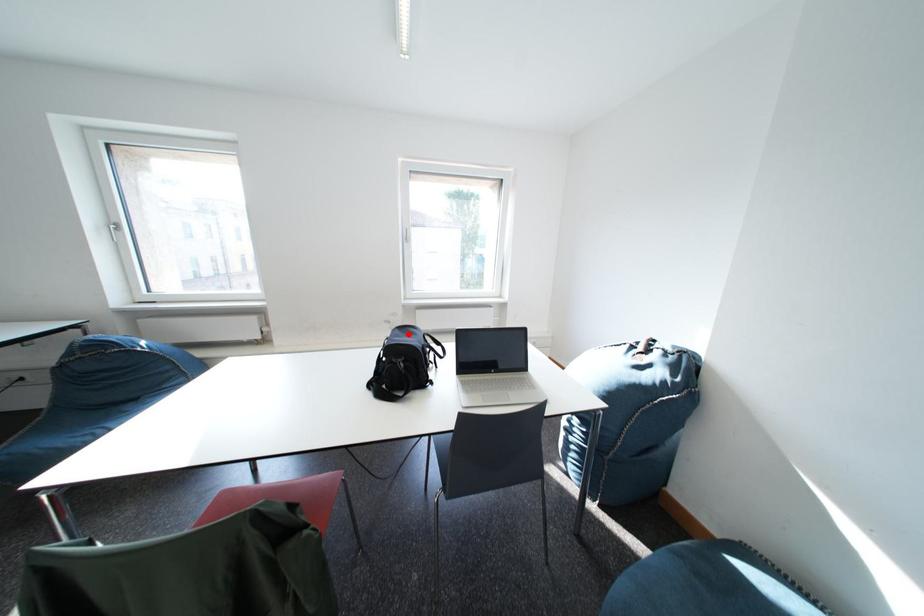
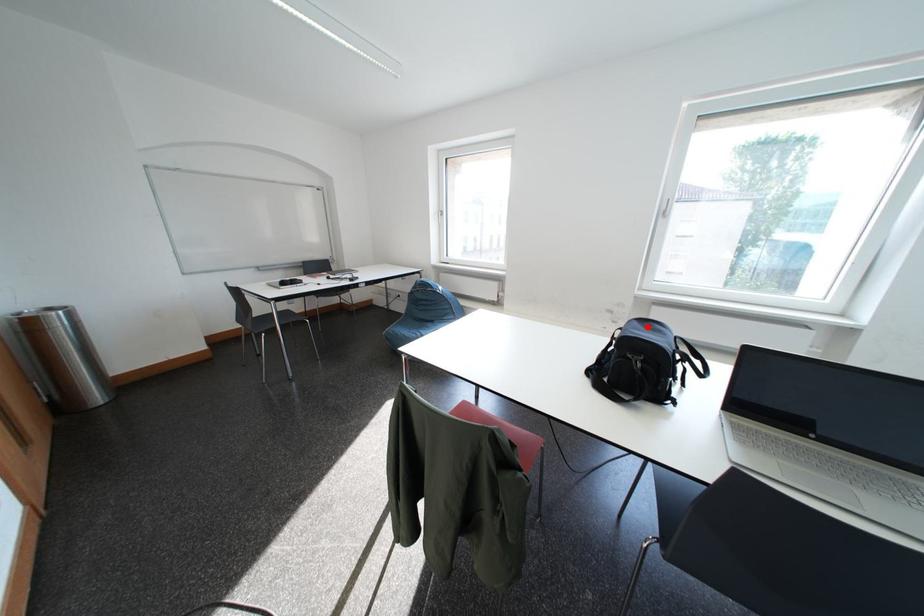
I am providing you with two images of the same scene from different viewpoints. A red point is marked on the first image and another point is marked on the second image. Are the points marked in image1 and image2 representing the same 3D position?

Yes